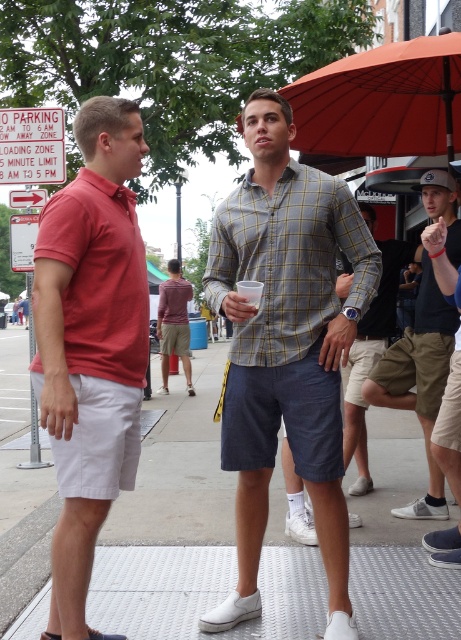
Question: Can you confirm if orange fabric umbrella at upper center is wider than matte red polo at left?

Choices:
 (A) no
 (B) yes

Answer: (B)

Question: Which of the following is the farthest from the observer?

Choices:
 (A) (133, 529)
 (B) (360, 136)
 (C) (176, 337)
 (D) (427, 493)

Answer: (C)

Question: Does orange fabric umbrella at upper center lie behind matte khaki shorts at center?

Choices:
 (A) yes
 (B) no

Answer: (B)

Question: Does matte red polo shirt at left have a smaller size compared to orange fabric umbrella at upper center?

Choices:
 (A) no
 (B) yes

Answer: (B)

Question: Which object is closer to the camera taking this photo?

Choices:
 (A) khaki cotton shorts at lower right
 (B) matte red polo shirt at left
 (C) maroon fabric shirt at center
 (D) metallic gray pavement at center

Answer: (B)

Question: Which point is farther to the camera?

Choices:
 (A) maroon fabric shirt at center
 (B) matte red polo shirt at left

Answer: (A)